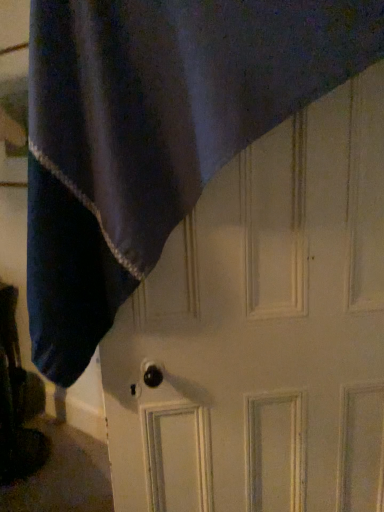
This screenshot has width=384, height=512. In order to click on velvet dark blue curtain at upper center in this screenshot , I will do `click(154, 134)`.

Describe the element at coordinates (154, 134) in the screenshot. This screenshot has height=512, width=384. I see `velvet dark blue curtain at upper center` at that location.

Identify the location of velvet dark blue curtain at upper center. (154, 134).